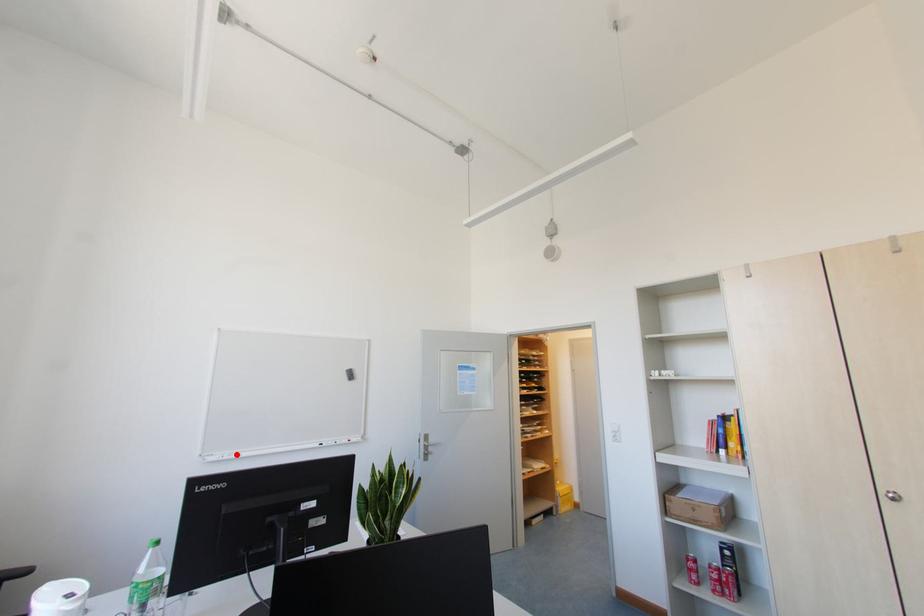
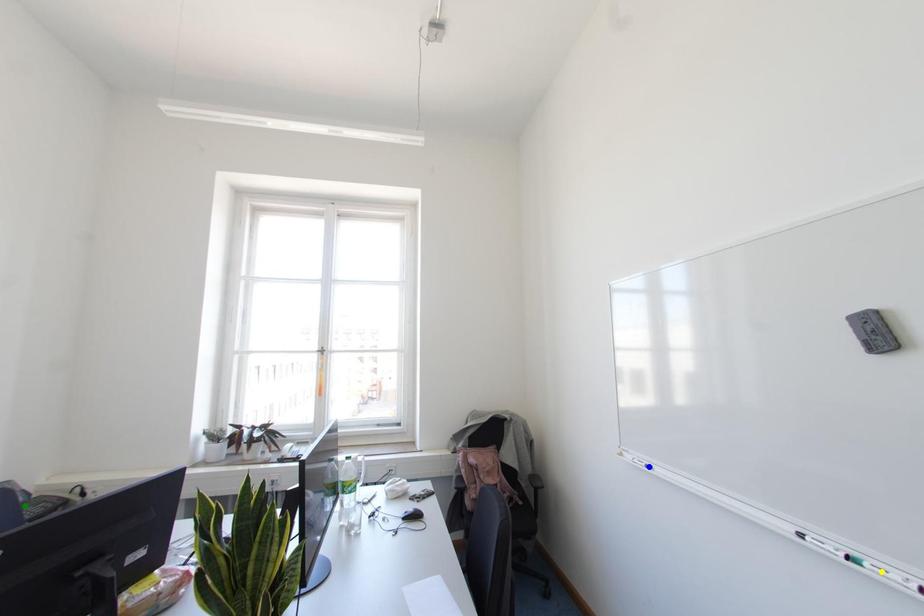
Question: I am providing you with two images of the same scene from different viewpoints. A red point is marked on the first image. You are given multiple points on the second image. Which point in image 2 is actually the same real-world point as the red point in image 1?

Choices:
 (A) yellow point
 (B) green point
 (C) blue point

Answer: (C)